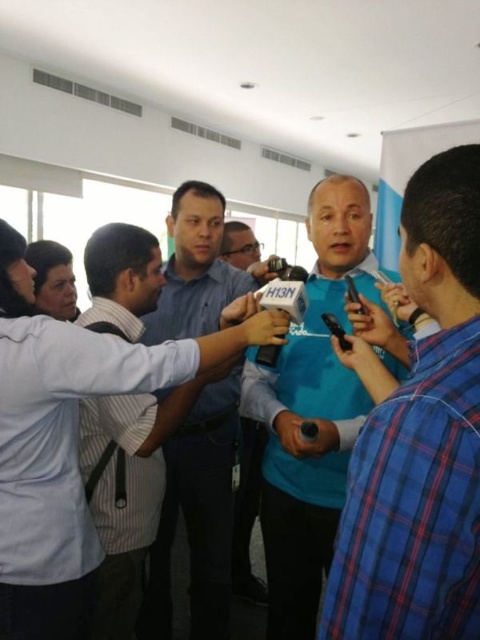
Question: Which of these objects is positioned farthest from the blue fabric shirt at center?

Choices:
 (A) light blue shirt at left
 (B) light blue shirt at center
 (C) blue shirt at center
 (D) blue plaid shirt at center

Answer: (D)

Question: Among these objects, which one is farthest from the camera?

Choices:
 (A) light blue shirt at left
 (B) blue plaid shirt at center
 (C) blue shirt at center
 (D) blue fabric shirt at center

Answer: (C)

Question: Can you confirm if light blue shirt at center is positioned above light blue shirt at left?

Choices:
 (A) no
 (B) yes

Answer: (B)

Question: Is light blue shirt at center closer to the viewer compared to blue plaid shirt at center?

Choices:
 (A) no
 (B) yes

Answer: (A)

Question: Can you confirm if light blue shirt at center is bigger than blue fabric shirt at center?

Choices:
 (A) yes
 (B) no

Answer: (B)

Question: Among these points, which one is nearest to the camera?

Choices:
 (A) (108, 264)
 (B) (312, 484)
 (C) (218, 224)

Answer: (A)